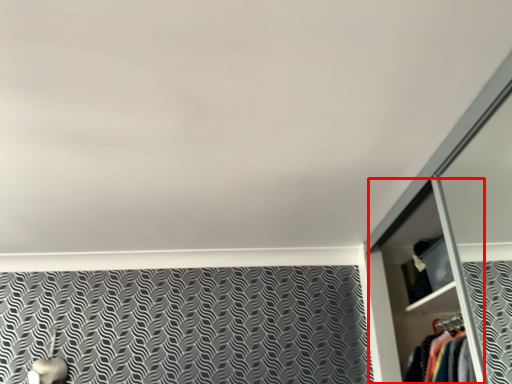
Question: Where is dresser (annotated by the red box) located in relation to cabinet in the image?

Choices:
 (A) right
 (B) left

Answer: (B)